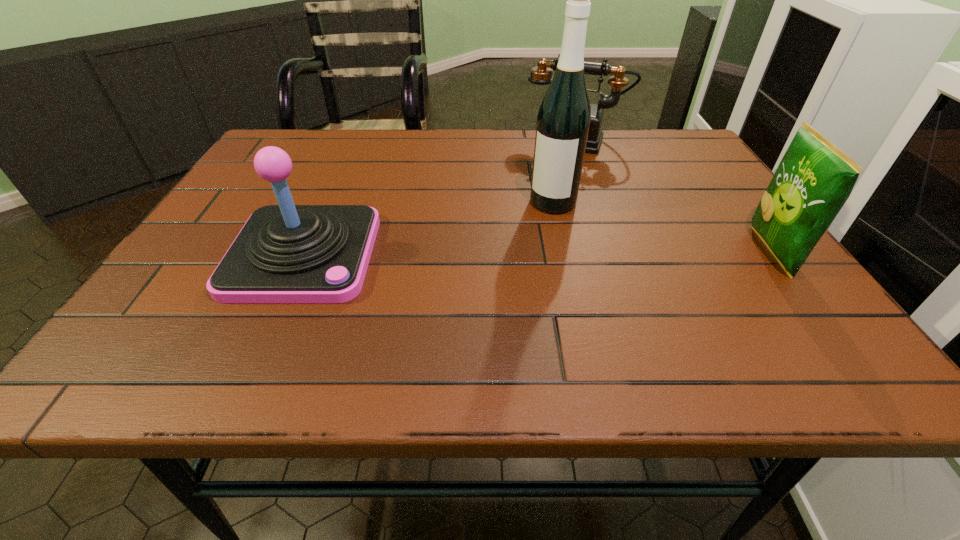
Identify the location of joystick. This screenshot has width=960, height=540. (286, 253).

The width and height of the screenshot is (960, 540). Identify the location of the rightmost object. coord(814,179).

You are a GUI agent. You are given a task and a screenshot of the screen. Output one action in this format:
    pyautogui.click(x=<x>, y=<y>)
    Task: Click on the wine bottle
    This screenshot has height=540, width=960.
    Given the screenshot: What is the action you would take?
    tap(563, 120)

I want to click on telephone, so click(542, 74).

Identify the location of vacant position located 0.290m on the front-facing side of the crisp (potato chip). The image size is (960, 540). (611, 252).

You are a GUI agent. You are given a task and a screenshot of the screen. Output one action in this format:
    pyautogui.click(x=<x>, y=<y>)
    Task: Click on the free space located on the front-facing side of the crisp (potato chip)
    This screenshot has width=960, height=540.
    Given the screenshot: What is the action you would take?
    pyautogui.click(x=575, y=252)

Locate an element on the screen. The width and height of the screenshot is (960, 540). vacant region located on the front-facing side of the crisp (potato chip) is located at coordinates (720, 252).

I want to click on vacant space located 0.350m on the label of the tallest object, so click(x=480, y=322).

Identify the location of vacant space located on the label of the tallest object. The width and height of the screenshot is (960, 540). (525, 248).

This screenshot has width=960, height=540. I want to click on vacant space located on the label of the tallest object, so click(490, 307).